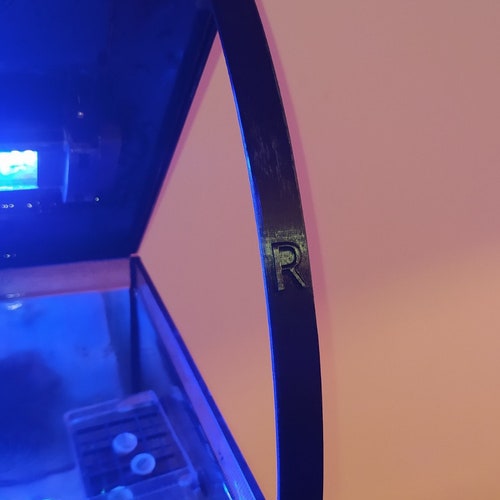
Locate an element on the screen. The height and width of the screenshot is (500, 500). wall under the hatch is located at coordinates (215, 263).